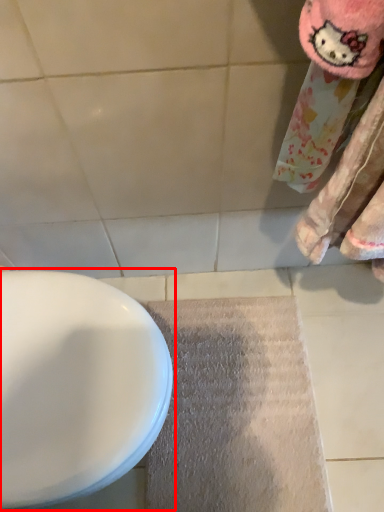
Question: Considering the relative positions of toilet (annotated by the red box) and doormat in the image provided, where is toilet (annotated by the red box) located with respect to the staircase?

Choices:
 (A) left
 (B) right

Answer: (A)